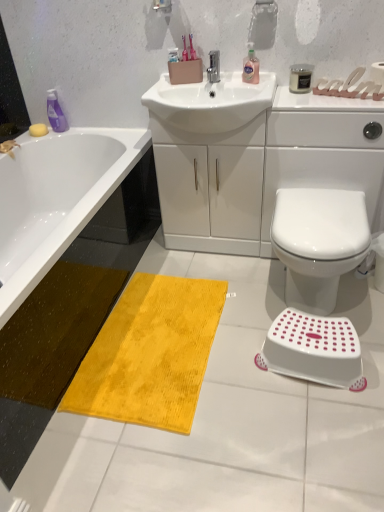
You are a GUI agent. You are given a task and a screenshot of the screen. Output one action in this format:
    pyautogui.click(x=<x>, y=<y>)
    Task: Click on the free space to the left of silver metallic faucet at center
    This screenshot has height=512, width=384.
    Given the screenshot: What is the action you would take?
    pyautogui.click(x=179, y=87)